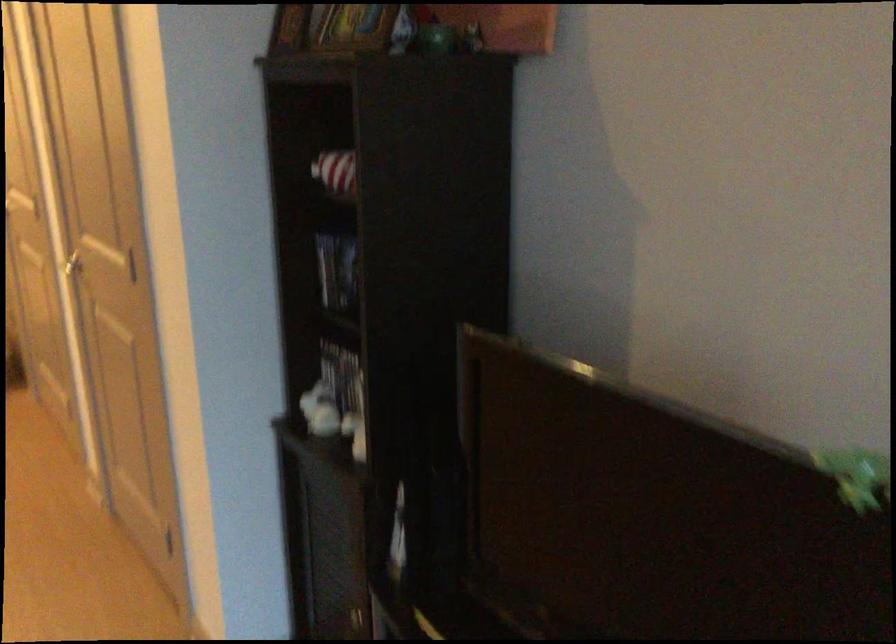
This screenshot has height=644, width=896. What are the coordinates of `silver door handle` in the screenshot? It's located at (73, 267).